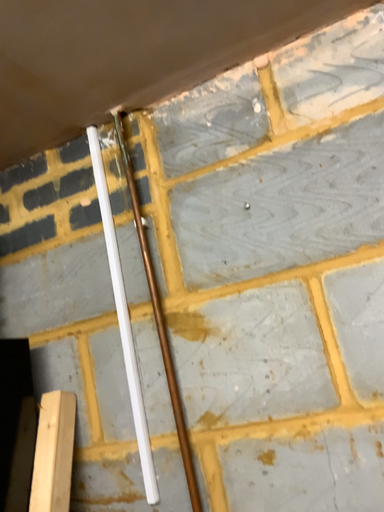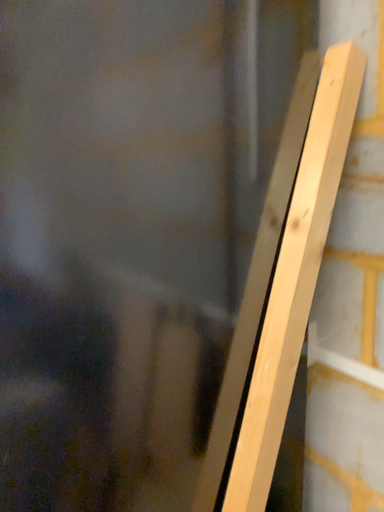
Question: Which way did the camera rotate in the video?

Choices:
 (A) rotated right
 (B) rotated left

Answer: (B)